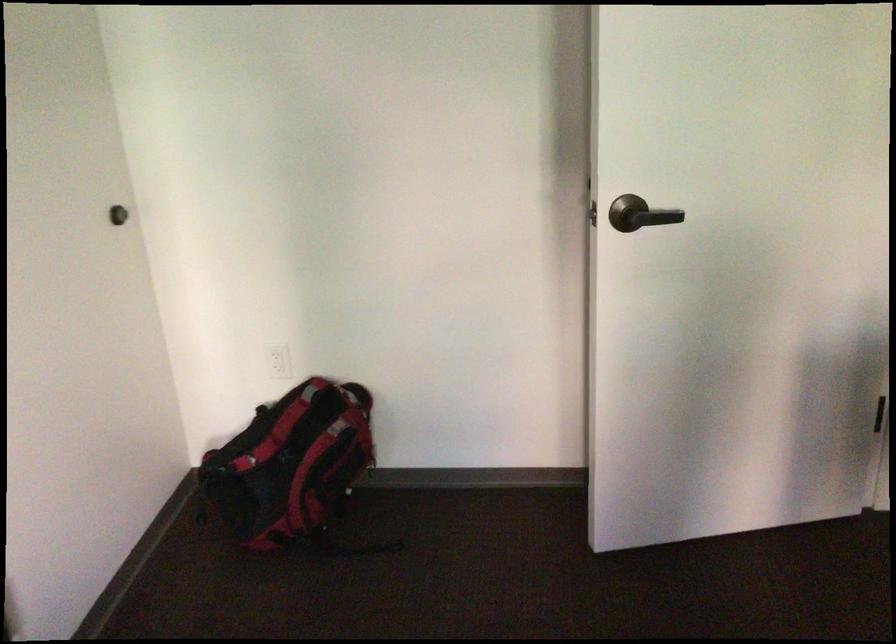
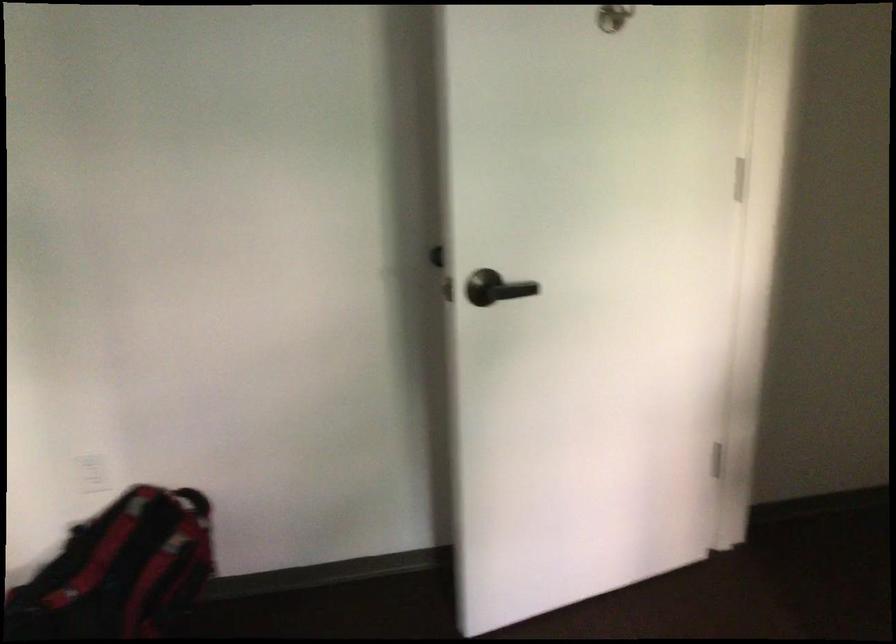
In the second image, find the point that corresponds to (642,212) in the first image.

(495, 288)